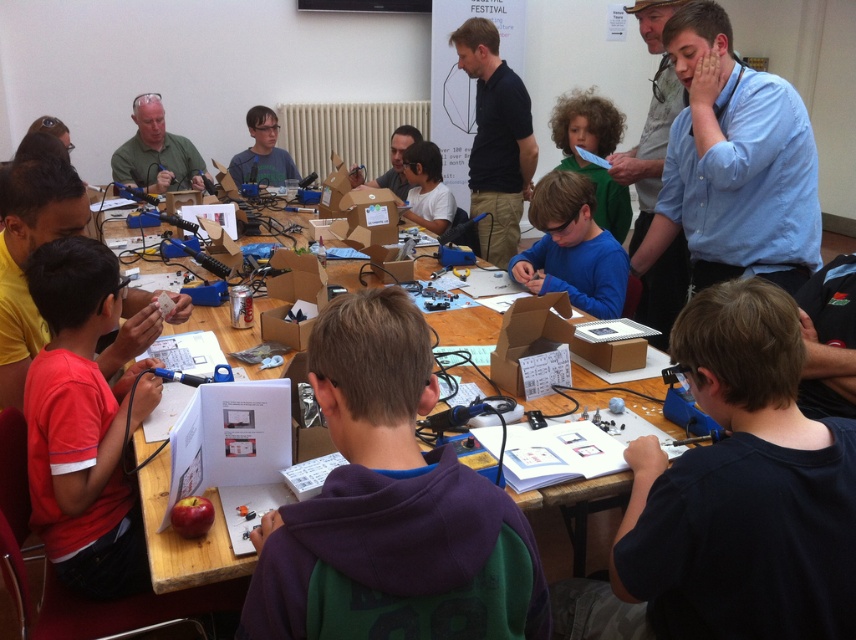
Question: Among these points, which one is nearest to the camera?

Choices:
 (A) (771, 132)
 (B) (340, 333)

Answer: (B)

Question: Which object appears farthest from the camera in this image?

Choices:
 (A) matte plastic boy at lower left
 (B) dark blue shirt at center
 (C) purple hoodie at center
 (D) wooden table at center

Answer: (D)

Question: Can you confirm if black cotton shirt at center is bigger than curly-haired boy at upper center?

Choices:
 (A) no
 (B) yes

Answer: (B)

Question: In this image, where is dark blue shirt at center located relative to red cotton shirt at left?

Choices:
 (A) left
 (B) right

Answer: (B)

Question: Which point is farther to the camera?

Choices:
 (A) (450, 220)
 (B) (140, 138)
 (C) (485, 132)

Answer: (B)

Question: Can you confirm if blue matte shirt at center is positioned below matte white shirt at center?

Choices:
 (A) no
 (B) yes

Answer: (B)